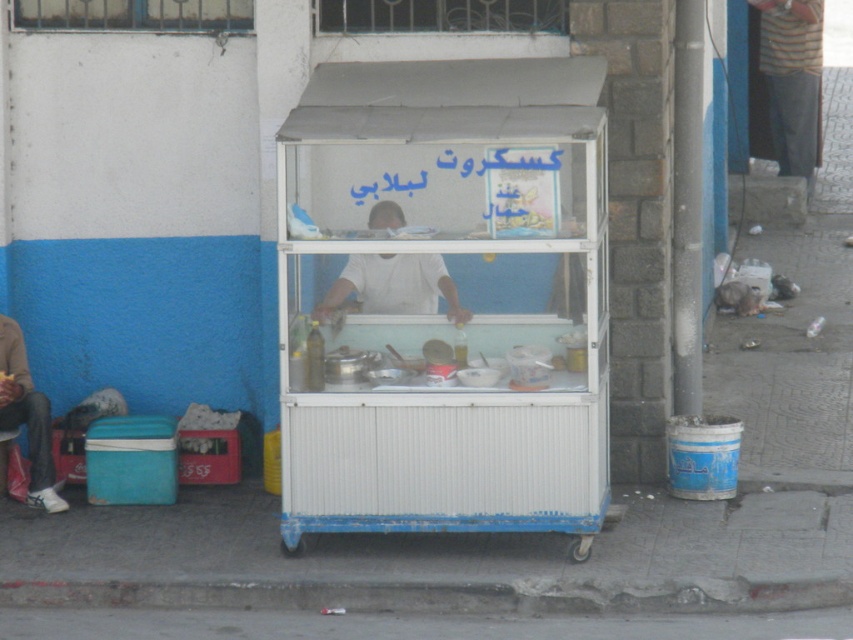
Consider the image. You are a customer standing in front of the food stall. You see the concrete at lower center and the matte black jacket at left. Which object is closer to you?

The concrete at lower center is closer to you because it is in front of the matte black jacket at left.

You are a customer standing in front of the food stall and want to reach the white metal cart at center. Which direction should you move relative to the white matte street vendor at center?

The white metal cart at center is to the right of the white matte street vendor at center, so you should move towards the right side of the white matte street vendor at center to reach it.